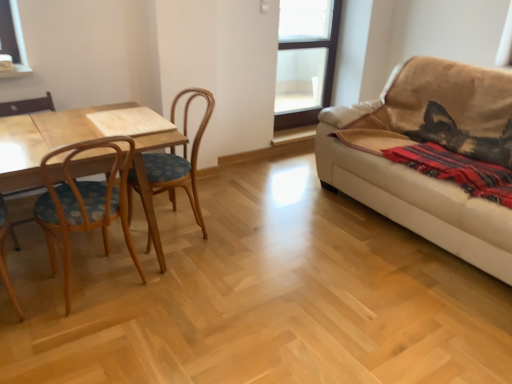
Locate an element on the screen. The height and width of the screenshot is (384, 512). vacant area that lies between woodenchair at left and wooden table at left is located at coordinates (195, 239).